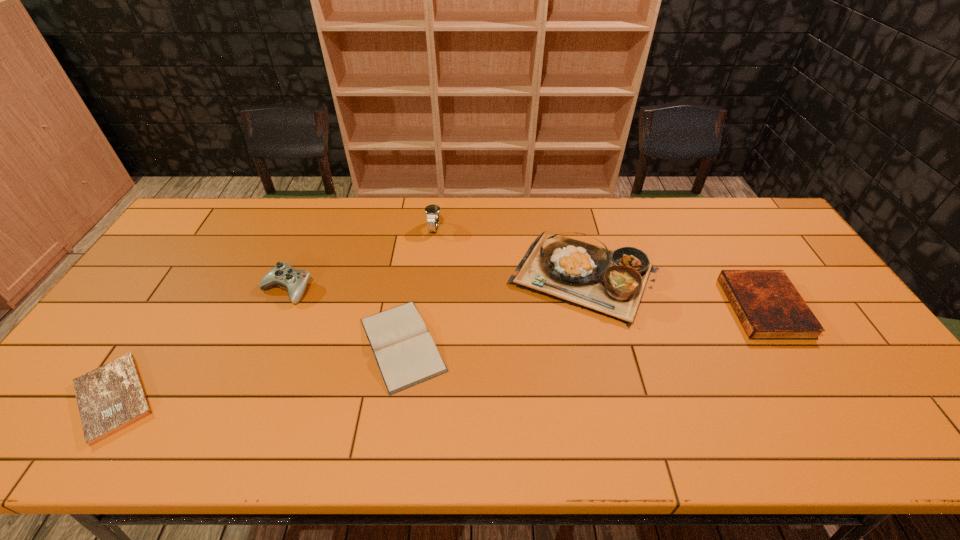
Select which Bible appears as the closest to the third shortest object. Please provide its 2D coordinates. Your answer should be formatted as a tuple, i.e. [(x, y)], where the tuple contains the x and y coordinates of a point satisfying the conditions above.

[(405, 352)]

Where is `free location that satisfies the following two spatial constraints: 1. on the back side of the watch; 2. on the left side of the fifth tallest object`? This screenshot has width=960, height=540. free location that satisfies the following two spatial constraints: 1. on the back side of the watch; 2. on the left side of the fifth tallest object is located at coordinates 420,228.